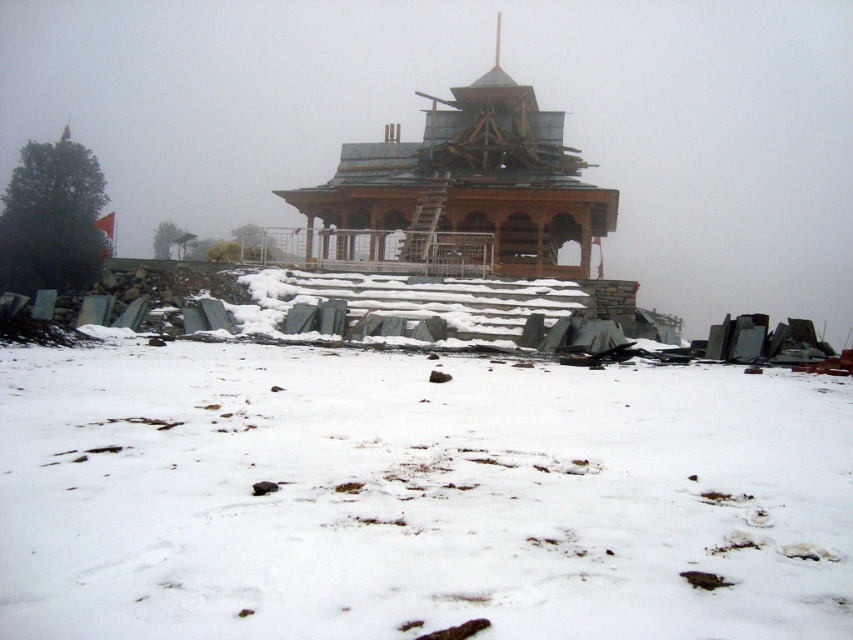
You are a construction worker tasked with placing a 2 meter tall statue on the white powdery snow at center. Considering the wooden temple at center is in the way, will the statue be visible from the base of the hill?

The white powdery snow at center has a lesser height compared to wooden temple at center, so the statue placed on the white powdery snow at center may be partially or fully obscured by the wooden temple at center depending on the temple height and statue placement.

You are an architect visiting a construction site. You see the white powdery snow at center and the wooden temple at center. Which object is positioned to the left?

The white powdery snow at center is to the left of the wooden temple at center.

You are an architect visiting a construction site. You see the white powdery snow at center and the wooden temple at center. Which one takes up more area in the image?

The wooden temple at center occupies more space than the white powdery snow at center, so the wooden temple at center takes up more area in the image.